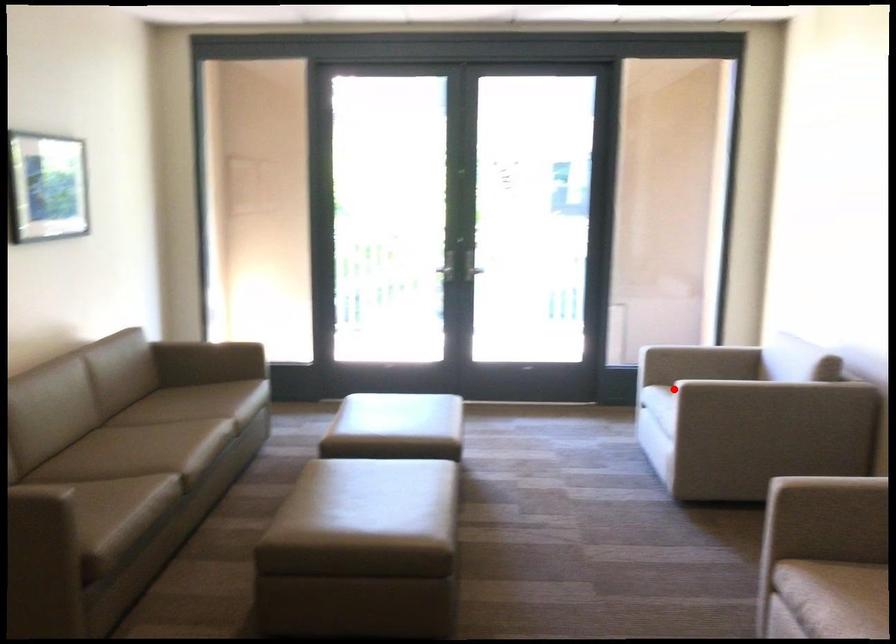
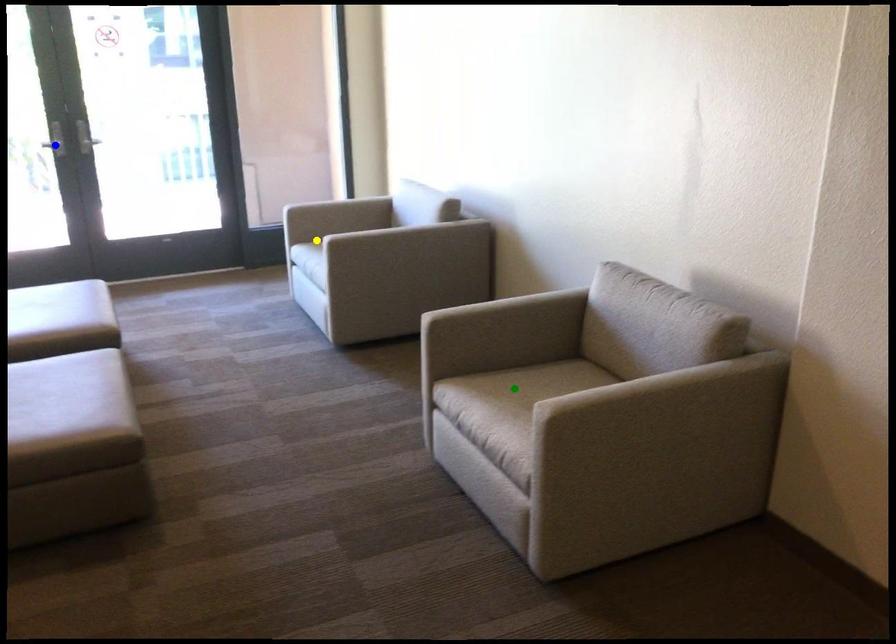
Question: I am providing you with two images of the same scene from different viewpoints. A red point is marked on the first image. You are given multiple points on the second image. Which mark in image 2 goes with the point in image 1?

Choices:
 (A) green point
 (B) yellow point
 (C) blue point

Answer: (B)